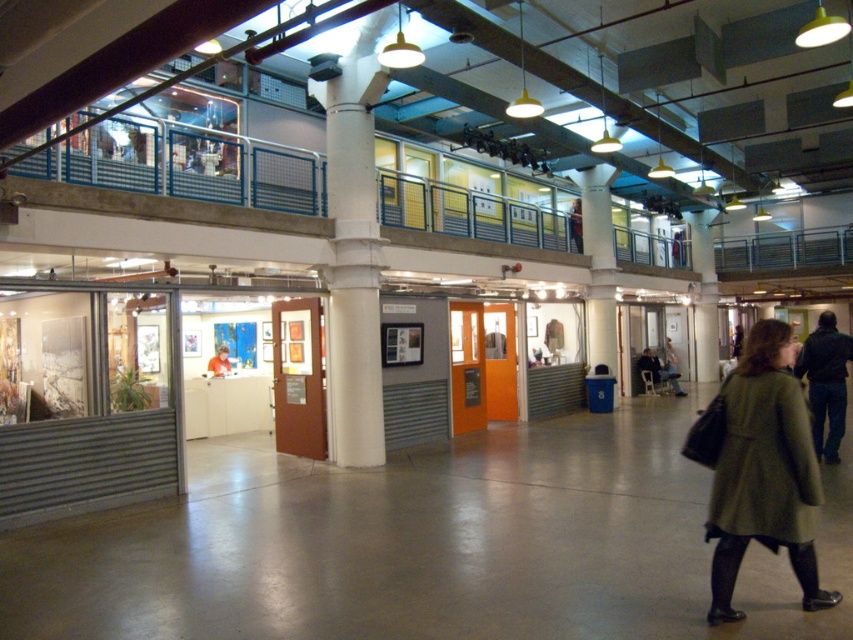
Question: Can you confirm if dark blue jacket at lower right is wider than orange fabric shirt at center?

Choices:
 (A) no
 (B) yes

Answer: (B)

Question: Based on their relative distances, which object is farther from the green woolen coat at lower right?

Choices:
 (A) green wool coat at lower right
 (B) white concrete pillar at center
 (C) orange fabric shirt at center
 (D) dark blue jacket at lower right

Answer: (B)

Question: Observing the image, what is the correct spatial positioning of dark blue jacket at lower right in reference to orange fabric shirt at center?

Choices:
 (A) right
 (B) left

Answer: (A)

Question: Can you confirm if green woolen coat at lower right is positioned to the left of dark blue jacket at lower right?

Choices:
 (A) no
 (B) yes

Answer: (B)

Question: Which point is farther to the camera?

Choices:
 (A) green woolen coat at lower right
 (B) green wool coat at lower right
 (C) orange fabric shirt at center

Answer: (C)

Question: Which object is farther from the camera taking this photo?

Choices:
 (A) orange fabric shirt at center
 (B) white concrete pillar at center
 (C) dark blue jacket at lower right
 (D) white glossy column at center

Answer: (B)